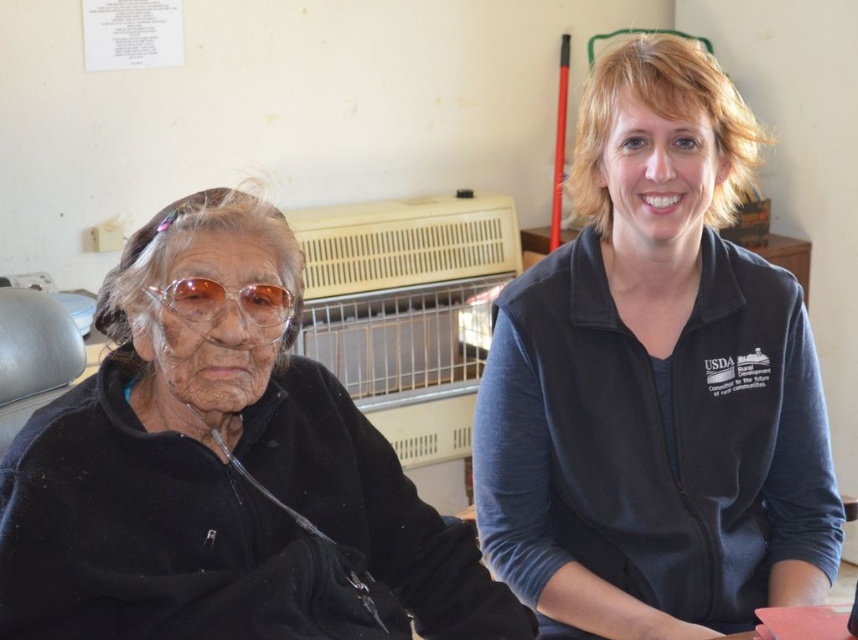
You are standing in the room and want to place a small plant between the two points, point(611, 508) and point(61, 481). Which point should you place it closer to so that it is in front of both points?

You should place the plant closer to point(61, 481) because it is in front of point(611, 508).

From the picture: You are standing 39.11 inches away from the point at coordinates (179, 609). If you want to move closer to that point, which direction should you move?

Since you are currently 39.11 inches away from the point at coordinates (179, 609), you should move towards the point to get closer.

You are a photographer setting up for a group photo. You have a camera with a focal length of 50mm. The blue fleece jacket at right and the translucent plastic goggles at upper left are 25.85 inches apart. What is the minimum distance you should stand from the subjects to ensure both objects are in frame without distortion?

To ensure both the blue fleece jacket at right and the translucent plastic goggles at upper left are in frame without distortion, you should stand at least 10 feet away. This distance allows the 50mm lens to capture the 25.85 inch separation comfortably within the camera sensor without stretching or compressing the scene.